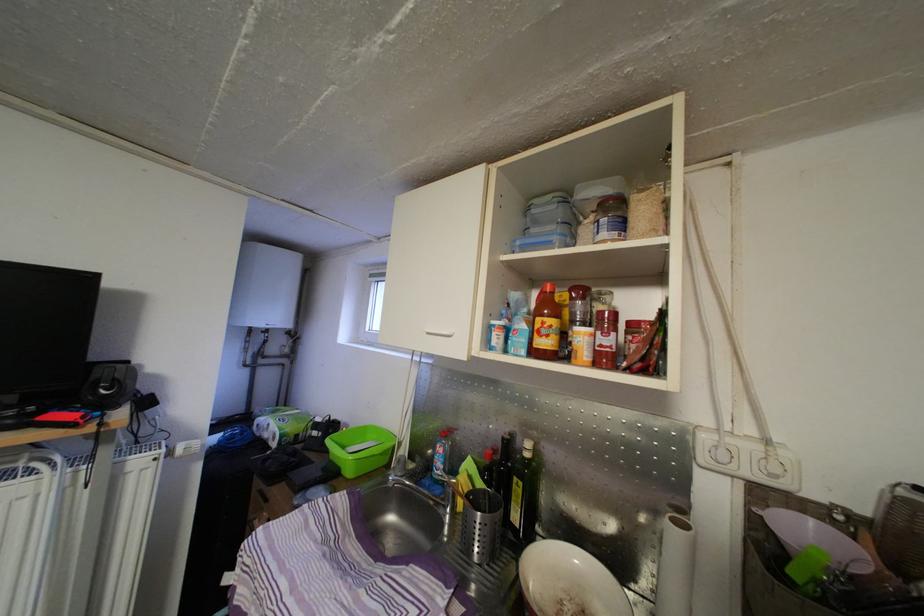
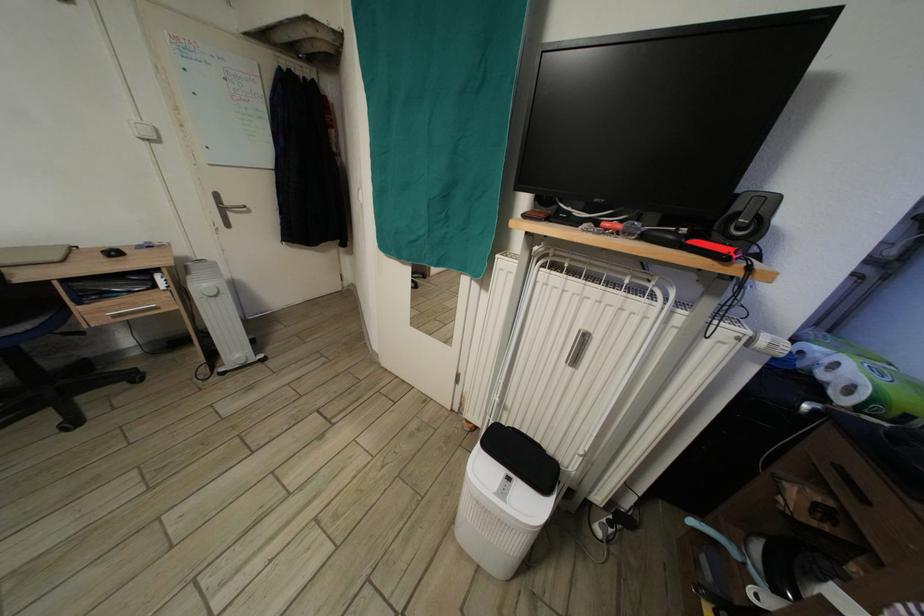
Find the pixel in the second image that matches point (103, 382) in the first image.

(744, 214)